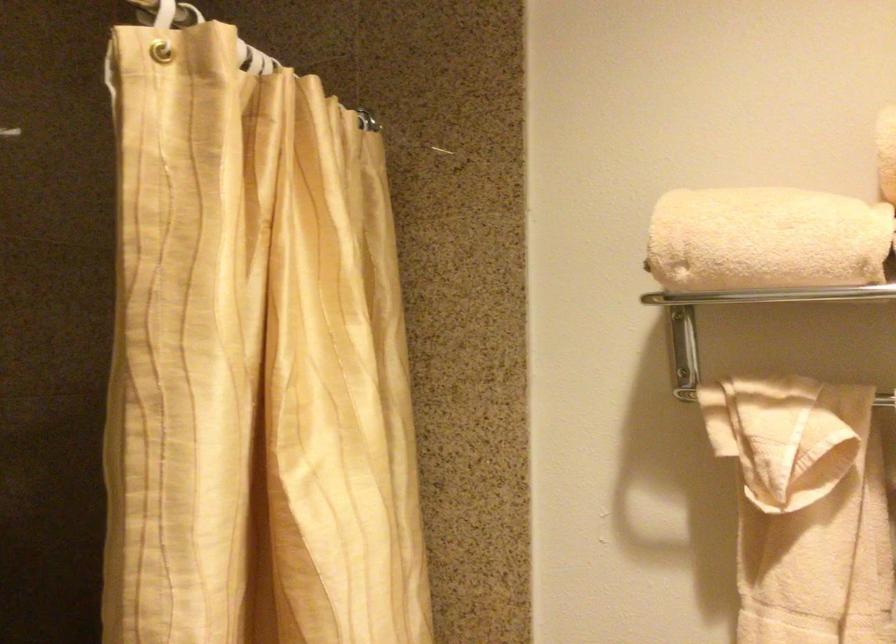
I want to click on shower curtain hook, so click(x=366, y=120).